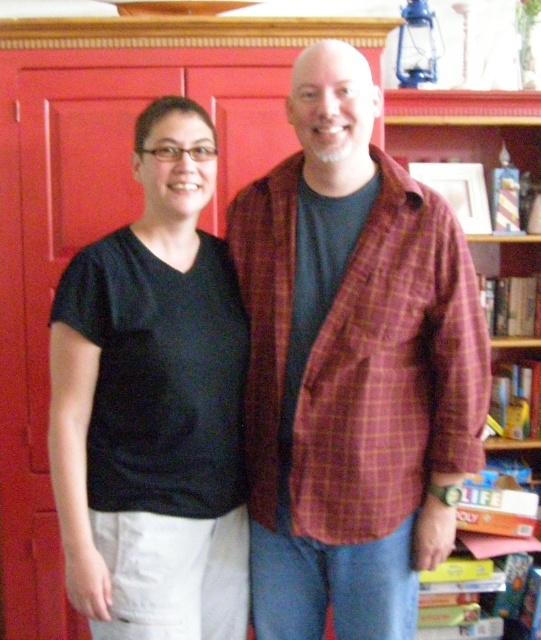
Measure the distance between point (471, 298) and camera.

1.39 meters

Is point (406, 588) farther from viewer compared to point (89, 364)?

Yes, it is.

Does point (397, 244) lie behind point (171, 122)?

No, it is in front of (171, 122).

The image size is (541, 640). I want to click on plaid fabric shirt at center, so coord(352,368).

Between black matte t-shirt at left and wooden bookshelf at right, which one is positioned lower?

Positioned lower is black matte t-shirt at left.

The height and width of the screenshot is (640, 541). What do you see at coordinates (154, 404) in the screenshot?
I see `black matte t-shirt at left` at bounding box center [154, 404].

This screenshot has width=541, height=640. Identify the location of black matte t-shirt at left. (154, 404).

Is plaid fabric shirt at center positioned behind wooden bookshelf at right?

No.

Does point (445, 552) come in front of point (465, 131)?

Yes, it is in front of point (465, 131).

Locate an element on the screen. The image size is (541, 640). plaid fabric shirt at center is located at coordinates (352, 368).